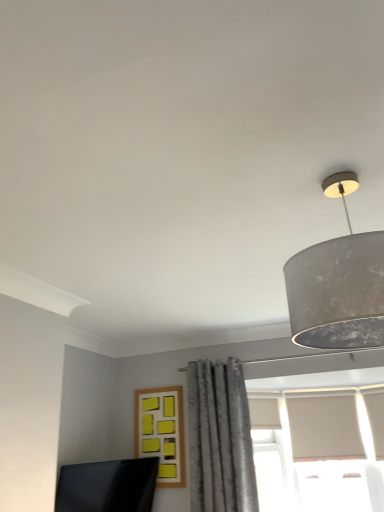
Question: From the image's perspective, would you say matte black monitor at lower left is positioned over yellow matte frame at center?

Choices:
 (A) no
 (B) yes

Answer: (A)

Question: Is matte black monitor at lower left not close to yellow matte frame at center?

Choices:
 (A) yes
 (B) no

Answer: (B)

Question: Could yellow matte frame at center be considered to be inside matte black monitor at lower left?

Choices:
 (A) no
 (B) yes

Answer: (A)

Question: Does matte black monitor at lower left have a larger size compared to yellow matte frame at center?

Choices:
 (A) yes
 (B) no

Answer: (A)

Question: Is matte black monitor at lower left directly adjacent to yellow matte frame at center?

Choices:
 (A) yes
 (B) no

Answer: (B)

Question: From the image's perspective, is matte black monitor at lower left under yellow matte frame at center?

Choices:
 (A) yes
 (B) no

Answer: (A)

Question: Is yellow matte frame at center taller than gray textured curtain at center?

Choices:
 (A) yes
 (B) no

Answer: (B)

Question: Is the position of yellow matte frame at center more distant than that of gray textured curtain at center?

Choices:
 (A) yes
 (B) no

Answer: (A)

Question: Is yellow matte frame at center beside gray textured curtain at center?

Choices:
 (A) yes
 (B) no

Answer: (B)

Question: Is yellow matte frame at center bigger than gray textured curtain at center?

Choices:
 (A) no
 (B) yes

Answer: (A)

Question: Considering the relative sizes of yellow matte frame at center and gray textured curtain at center in the image provided, is yellow matte frame at center shorter than gray textured curtain at center?

Choices:
 (A) yes
 (B) no

Answer: (A)

Question: From a real-world perspective, is yellow matte frame at center positioned over gray textured curtain at center based on gravity?

Choices:
 (A) no
 (B) yes

Answer: (B)

Question: Considering the relative sizes of gray textured curtain at center and matte black monitor at lower left in the image provided, is gray textured curtain at center smaller than matte black monitor at lower left?

Choices:
 (A) yes
 (B) no

Answer: (B)